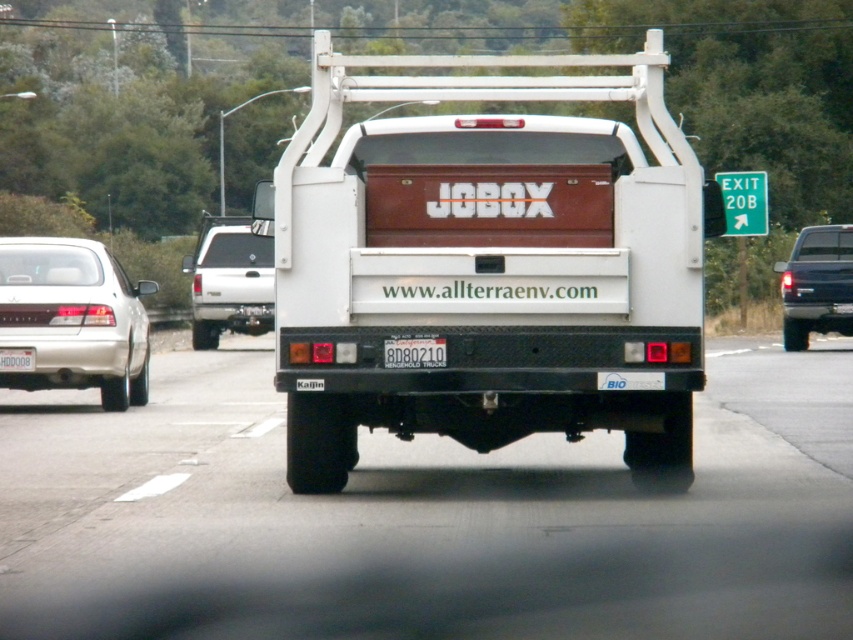
Identify the location of glossy black truck at right. (817, 284).

Between glossy black truck at right and black plastic license plate at center, which one has less height?

Standing shorter between the two is black plastic license plate at center.

Locate an element on the screen. glossy black truck at right is located at coordinates (817, 284).

Who is shorter, black metal truck bed at center or black plastic license plate at center?

black plastic license plate at center

Between black metal truck bed at center and black plastic license plate at center, which one is positioned higher?

black plastic license plate at center is above.

This screenshot has width=853, height=640. What do you see at coordinates (425, 516) in the screenshot?
I see `black metal truck bed at center` at bounding box center [425, 516].

Identify the location of black metal truck bed at center. The width and height of the screenshot is (853, 640). (425, 516).

Who is shorter, satin silver sedan at left or glossy black truck at right?

glossy black truck at right is shorter.

Is satin silver sedan at left to the right of glossy black truck at right from the viewer's perspective?

No, satin silver sedan at left is not to the right of glossy black truck at right.

Locate an element on the screen. The height and width of the screenshot is (640, 853). satin silver sedan at left is located at coordinates (73, 317).